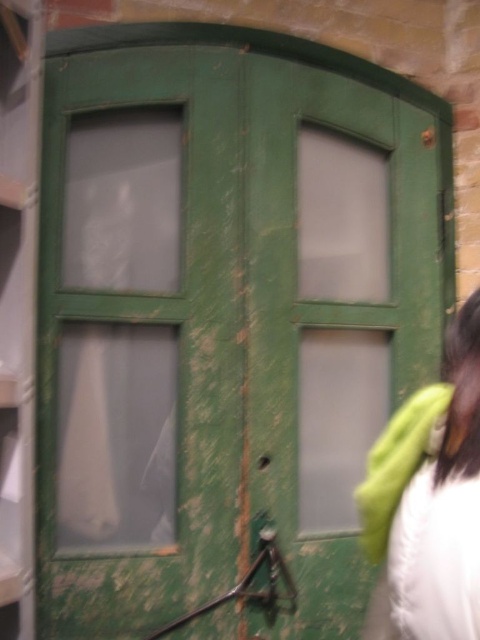
Question: Which point is closer to the camera taking this photo?

Choices:
 (A) (458, 316)
 (B) (399, 484)

Answer: (B)

Question: Can you confirm if white fabric at right is positioned to the left of green matte jacket at lower right?

Choices:
 (A) yes
 (B) no

Answer: (B)

Question: Can you confirm if white fabric at right is positioned to the left of green matte jacket at lower right?

Choices:
 (A) no
 (B) yes

Answer: (A)

Question: Among these points, which one is farthest from the camera?

Choices:
 (A) (394, 429)
 (B) (416, 435)

Answer: (A)

Question: Does white fabric at right have a greater width compared to green matte jacket at lower right?

Choices:
 (A) yes
 (B) no

Answer: (A)

Question: Which point is closer to the camera taking this photo?

Choices:
 (A) (372, 458)
 (B) (382, 572)

Answer: (A)